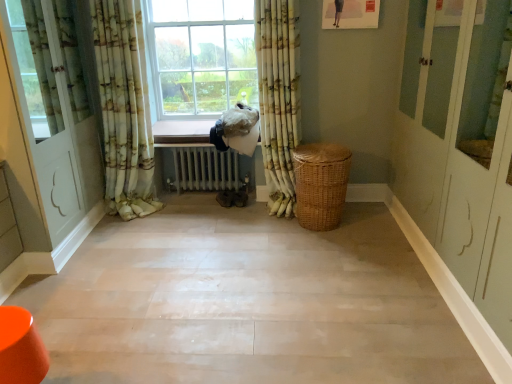
The height and width of the screenshot is (384, 512). Identify the location of unoccupied region to the right of woven brown basket at center-right. (369, 224).